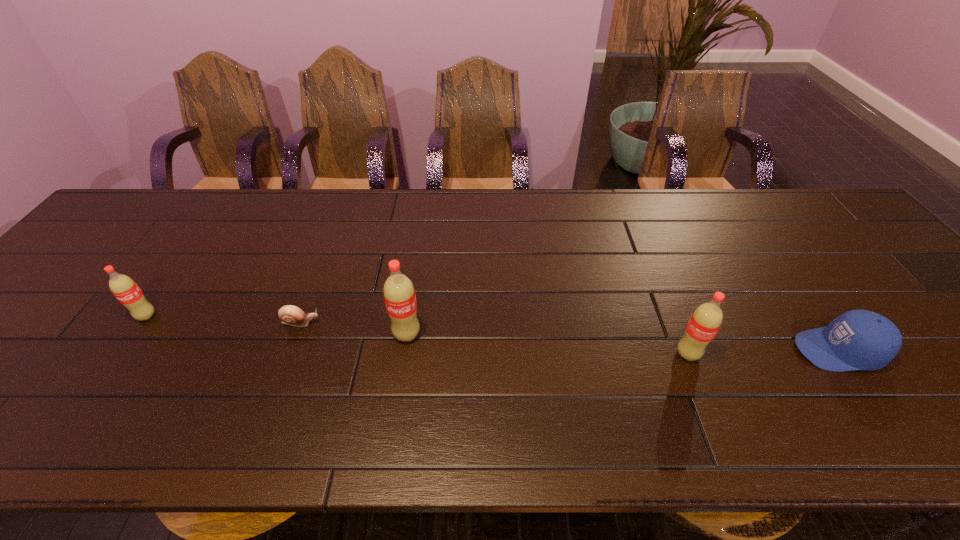
Where is `the leftmost soda`? Image resolution: width=960 pixels, height=540 pixels. the leftmost soda is located at coordinates (124, 288).

Where is `the leftmost object`? The width and height of the screenshot is (960, 540). the leftmost object is located at coordinates (124, 288).

Locate an element on the screen. The height and width of the screenshot is (540, 960). the third object from left to right is located at coordinates (399, 295).

I want to click on the fourth object from left to right, so click(705, 321).

The image size is (960, 540). I want to click on the second tallest soda, so click(x=705, y=321).

The width and height of the screenshot is (960, 540). I want to click on escargot, so click(291, 315).

Where is `the shortest object`? The height and width of the screenshot is (540, 960). the shortest object is located at coordinates (291, 315).

This screenshot has width=960, height=540. What are the coordinates of `the second shortest object` in the screenshot? It's located at (858, 339).

At what (x,y) coordinates should I click in order to perform the action: click on cap. Please return your answer as a coordinate pair (x, y). Looking at the image, I should click on (858, 339).

Identify the location of vacant space situated 0.150m on the right of the leftmost soda. (219, 316).